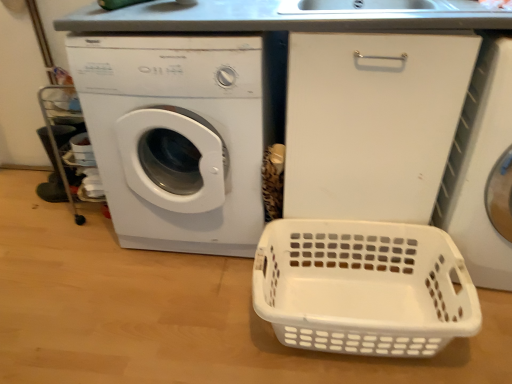
Question: Considering the relative sizes of white plastic basket at lower right and white plastic washing machine at right, acting as the 2th washing machine starting from the left, in the image provided, is white plastic basket at lower right thinner than white plastic washing machine at right, acting as the 2th washing machine starting from the left,?

Choices:
 (A) yes
 (B) no

Answer: (A)

Question: Is white plastic basket at lower right aimed at white plastic washing machine at right, acting as the 2th washing machine starting from the left?

Choices:
 (A) no
 (B) yes

Answer: (A)

Question: Does white plastic basket at lower right have a lesser height compared to white plastic washing machine at right, acting as the 2th washing machine starting from the left?

Choices:
 (A) yes
 (B) no

Answer: (A)

Question: From a real-world perspective, is white plastic basket at lower right physically below white plastic washing machine at right, the 1th washing machine from the right?

Choices:
 (A) yes
 (B) no

Answer: (A)

Question: Is white plastic basket at lower right wider than white plastic washing machine at right, acting as the 2th washing machine starting from the left?

Choices:
 (A) yes
 (B) no

Answer: (B)

Question: Does white plastic basket at lower right appear on the right side of white plastic washing machine at right, acting as the 2th washing machine starting from the left?

Choices:
 (A) yes
 (B) no

Answer: (B)

Question: From a real-world perspective, is white plastic washing machine at left, arranged as the second washing machine when viewed from the right, on top of white plastic basket at lower right?

Choices:
 (A) yes
 (B) no

Answer: (A)

Question: Would you say white plastic washing machine at left, the 1th washing machine from the left, is outside white plastic basket at lower right?

Choices:
 (A) yes
 (B) no

Answer: (A)

Question: Is the position of white plastic washing machine at left, arranged as the second washing machine when viewed from the right, more distant than that of white plastic basket at lower right?

Choices:
 (A) yes
 (B) no

Answer: (A)

Question: From a real-world perspective, is white plastic washing machine at left, the 1th washing machine from the left, below white plastic basket at lower right?

Choices:
 (A) yes
 (B) no

Answer: (B)

Question: Considering the relative sizes of white plastic washing machine at left, the 1th washing machine from the left, and white plastic basket at lower right in the image provided, is white plastic washing machine at left, the 1th washing machine from the left, taller than white plastic basket at lower right?

Choices:
 (A) no
 (B) yes

Answer: (B)

Question: Is white plastic washing machine at left, the 1th washing machine from the left, positioned with its back to white plastic basket at lower right?

Choices:
 (A) yes
 (B) no

Answer: (B)

Question: Is white plastic washing machine at right, acting as the 2th washing machine starting from the left, turned away from white plastic washing machine at left, arranged as the second washing machine when viewed from the right?

Choices:
 (A) no
 (B) yes

Answer: (A)